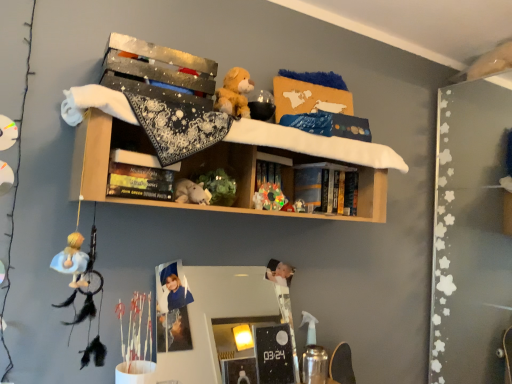
Question: Is shiny plastic toy at center, which ranks as the third toy in left-to-right order, in front of or behind blue hardcover book at center, acting as the second book starting from the front, in the image?

Choices:
 (A) front
 (B) behind

Answer: (A)

Question: Does point (269, 187) appear closer or farther from the camera than point (316, 185)?

Choices:
 (A) farther
 (B) closer

Answer: (B)

Question: Which of these objects is positioned farthest from the hardcover book at center, the 2th book when ordered from back to front?

Choices:
 (A) wooden shelf at upper center
 (B) white plush toy at center, which appears as the 2th toy when viewed from the left
 (C) shiny plastic toy at center, the 1th toy when ordered from right to left
 (D) white plush toy at center, the third toy in the right-to-left sequence
 (E) blue hardcover book at center, acting as the 2th book starting from the left

Answer: (E)

Question: Which object is the closest to the white plush toy at center, the second toy viewed from the right?

Choices:
 (A) white plush toy at center, the third toy in the right-to-left sequence
 (B) wooden shelf at upper center
 (C) shiny plastic toy at center, the 1th toy when ordered from right to left
 (D) blue hardcover book at center, acting as the second book starting from the front
 (E) hardcover book at center, the 1th book viewed from the left

Answer: (C)